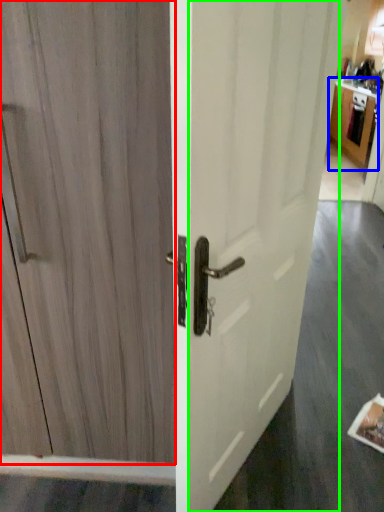
Question: Based on their relative distances, which object is farther from door (highlighted by a red box)? Choose from cabinetry (highlighted by a blue box) and screen door (highlighted by a green box).

Choices:
 (A) cabinetry
 (B) screen door

Answer: (A)